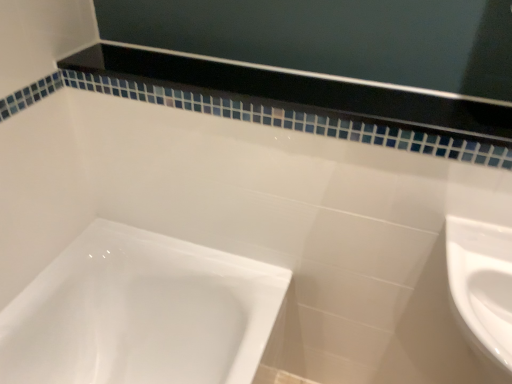
Measure the distance between white glossy sink at lower right and camera.

white glossy sink at lower right and camera are 26.05 inches apart.

I want to click on white glossy sink at lower right, so click(x=482, y=290).

Describe the element at coordinates (482, 290) in the screenshot. I see `white glossy sink at lower right` at that location.

Describe the element at coordinates (301, 93) in the screenshot. This screenshot has height=384, width=512. I see `black glossy balustrade at upper center` at that location.

I want to click on black glossy balustrade at upper center, so click(301, 93).

I want to click on white glossy sink at lower right, so click(x=482, y=290).

Is black glossy balustrade at upper center to the left of white glossy sink at lower right from the viewer's perspective?

Yes.

Which is behind, black glossy balustrade at upper center or white glossy sink at lower right?

black glossy balustrade at upper center is behind.

Is point (504, 123) farther from viewer compared to point (464, 279)?

Yes.

From the image's perspective, would you say black glossy balustrade at upper center is shown under white glossy sink at lower right?

Actually, black glossy balustrade at upper center appears above white glossy sink at lower right in the image.

From a real-world perspective, is black glossy balustrade at upper center above or below white glossy sink at lower right?

In terms of real-world spatial position, black glossy balustrade at upper center is above white glossy sink at lower right.

Between black glossy balustrade at upper center and white glossy sink at lower right, which one has smaller width?

Thinner between the two is black glossy balustrade at upper center.

Can you confirm if black glossy balustrade at upper center is shorter than white glossy sink at lower right?

Yes, black glossy balustrade at upper center is shorter than white glossy sink at lower right.

Based on their sizes in the image, would you say black glossy balustrade at upper center is bigger or smaller than white glossy sink at lower right?

Considering their sizes, black glossy balustrade at upper center takes up less space than white glossy sink at lower right.

Would you say black glossy balustrade at upper center contains white glossy sink at lower right?

That's incorrect, white glossy sink at lower right is not inside black glossy balustrade at upper center.

Is black glossy balustrade at upper center in contact with white glossy sink at lower right?

No, black glossy balustrade at upper center is not in contact with white glossy sink at lower right.

Is black glossy balustrade at upper center aimed at white glossy sink at lower right?

No, black glossy balustrade at upper center is not oriented towards white glossy sink at lower right.

How much distance is there between black glossy balustrade at upper center and white glossy sink at lower right?

They are 38.78 centimeters apart.

The image size is (512, 384). Find the location of `balustrade above the white glossy sink at lower right (from a real-world perspective)`. balustrade above the white glossy sink at lower right (from a real-world perspective) is located at coordinates (301, 93).

Considering the positions of objects white glossy sink at lower right and black glossy balustrade at upper center in the image provided, who is more to the right, white glossy sink at lower right or black glossy balustrade at upper center?

From the viewer's perspective, white glossy sink at lower right appears more on the right side.

Considering the relative positions of white glossy sink at lower right and black glossy balustrade at upper center in the image provided, is white glossy sink at lower right behind black glossy balustrade at upper center?

No, it is in front of black glossy balustrade at upper center.

Considering the positions of point (456, 291) and point (393, 122), is point (456, 291) closer or farther from the camera than point (393, 122)?

Point (456, 291) is closer to the camera than point (393, 122).

From the image's perspective, does white glossy sink at lower right appear higher than black glossy balustrade at upper center?

No, from the image's perspective, white glossy sink at lower right is not above black glossy balustrade at upper center.

From a real-world perspective, is white glossy sink at lower right positioned above or below black glossy balustrade at upper center?

white glossy sink at lower right is below black glossy balustrade at upper center.

Which object is wider, white glossy sink at lower right or black glossy balustrade at upper center?

Wider between the two is white glossy sink at lower right.

In the scene shown: In terms of height, does white glossy sink at lower right look taller or shorter compared to black glossy balustrade at upper center?

white glossy sink at lower right is taller than black glossy balustrade at upper center.

Considering the sizes of white glossy sink at lower right and black glossy balustrade at upper center in the image, is white glossy sink at lower right bigger or smaller than black glossy balustrade at upper center?

white glossy sink at lower right is bigger than black glossy balustrade at upper center.

Is white glossy sink at lower right not within black glossy balustrade at upper center?

white glossy sink at lower right is positioned outside black glossy balustrade at upper center.

Is white glossy sink at lower right with black glossy balustrade at upper center?

No, white glossy sink at lower right is not beside black glossy balustrade at upper center.

Could you tell me if white glossy sink at lower right is facing black glossy balustrade at upper center?

No, white glossy sink at lower right is not oriented towards black glossy balustrade at upper center.

Locate an element on the screen. sink on the right side of black glossy balustrade at upper center is located at coordinates (482, 290).

Image resolution: width=512 pixels, height=384 pixels. In order to click on balustrade to the left of white glossy sink at lower right in this screenshot , I will do `click(301, 93)`.

At what (x,y) coordinates should I click in order to perform the action: click on sink directly beneath the black glossy balustrade at upper center (from a real-world perspective). Please return your answer as a coordinate pair (x, y). This screenshot has width=512, height=384. Looking at the image, I should click on (482, 290).